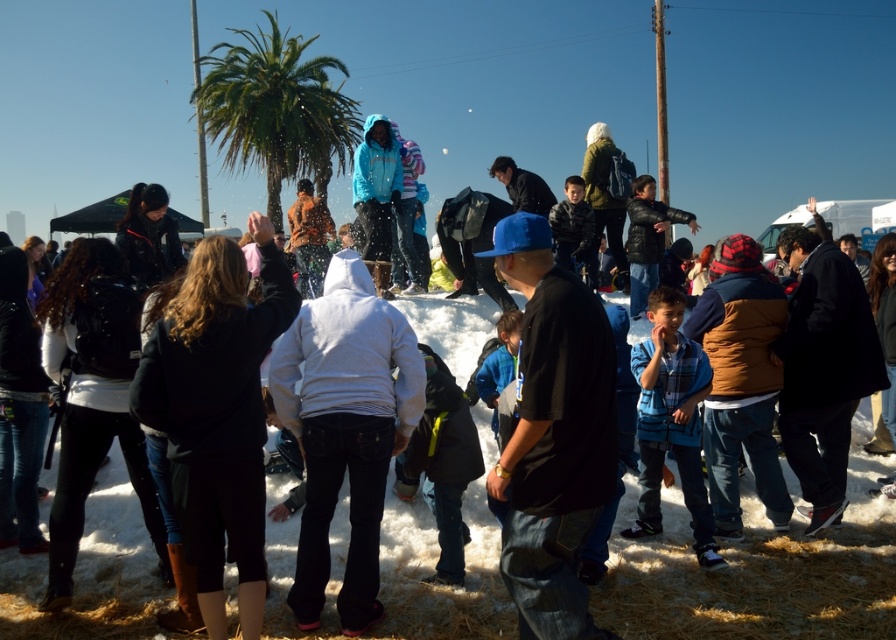
Looking at this image, you are a photographer trying to capture a photo of the black matte shirt at center and the green leafy palm tree at upper center in the same frame. Given that your camera has a maximum focus range of 15 meters, will you be able to include both objects in a single focused shot?

The distance between the black matte shirt at center and the green leafy palm tree at upper center is 15.93 meters, which exceeds the camera maximum focus range of 15 meters. Therefore, you cannot capture both objects in a single focused shot.

You are a photographer trying to capture a clear shot of the black matte shirt at center and the green leafy palm tree at upper center. Since the palm tree is in the background, will the shirt block the view of the tree?

The black matte shirt at center is thinner than the green leafy palm tree at upper center, so the shirt is not wide enough to completely block the view of the tree.

You are a photographer trying to capture the black matte shirt at center and the green leafy palm tree at upper center in the same frame. Based on their sizes, which object would appear closer to the camera?

The black matte shirt at center appears closer to the camera because it has a smaller size compared to the green leafy palm tree at upper center.